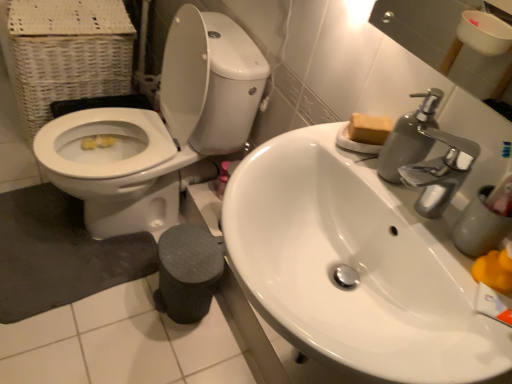
Where is `vacant space to the left of metallic gray soap dispenser at upper right`? vacant space to the left of metallic gray soap dispenser at upper right is located at coordinates (323, 148).